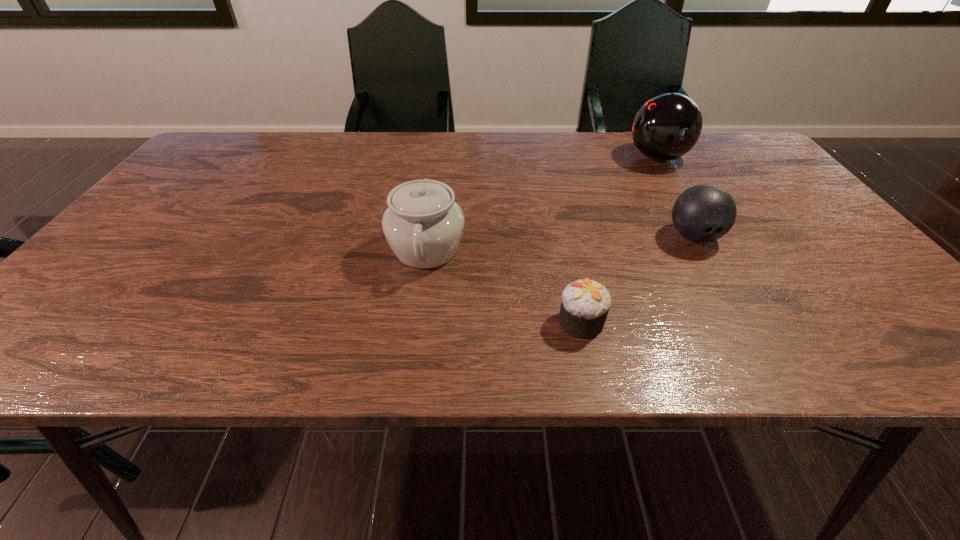
Identify the location of free space located 0.130m on the surface of the farther bowling ball near the finger holes. The height and width of the screenshot is (540, 960). (583, 158).

The height and width of the screenshot is (540, 960). What are the coordinates of `vacant space situated 0.330m on the left of the chinaware` in the screenshot? It's located at (240, 249).

Find the location of `vacant space located 0.100m on the grip area of the nearer bowling ball`. vacant space located 0.100m on the grip area of the nearer bowling ball is located at coordinates (722, 286).

Where is `free spot located on the right of the third object from right to left`? free spot located on the right of the third object from right to left is located at coordinates (699, 322).

What are the coordinates of `object that is at the far edge` in the screenshot? It's located at (667, 126).

Locate an element on the screen. object positioned at the near edge is located at coordinates (585, 304).

This screenshot has height=540, width=960. Identify the location of vacant space at the far edge of the desktop. (360, 165).

In the image, there is a desktop. Where is `free space at the near edge`? free space at the near edge is located at coordinates (204, 346).

The image size is (960, 540). What are the coordinates of `vacant area at the left edge` in the screenshot? It's located at (169, 208).

Locate an element on the screen. The width and height of the screenshot is (960, 540). vacant space at the right edge of the desktop is located at coordinates (775, 214).